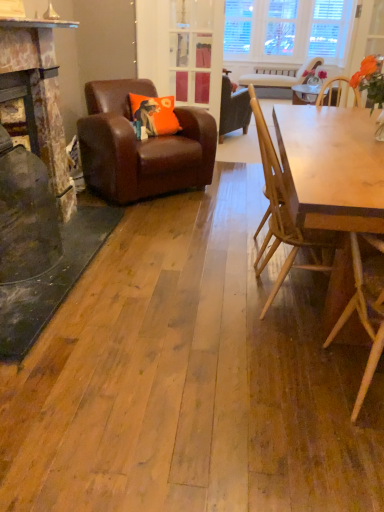
Question: Do you think light brown wooden table at right is within clear glass door at center, or outside of it?

Choices:
 (A) outside
 (B) inside

Answer: (A)

Question: Based on their positions, is light brown wooden table at right located to the left or right of clear glass door at center?

Choices:
 (A) left
 (B) right

Answer: (B)

Question: Based on their relative distances, which object is farther from the brown leather armchair at left, which is the 2th chair in back-to-front order?

Choices:
 (A) orange fabric pillow at center-left
 (B) light beige wood chair at upper center, the fourth chair ordered from the bottom
 (C) wooden chair at right, the second chair positioned from the bottom
 (D) light brown wooden table at right
 (E) clear glass door at center

Answer: (B)

Question: Which object is positioned farthest from the light beige wood chair at upper center, placed as the fourth chair when sorted from front to back?

Choices:
 (A) clear glass door at center
 (B) light brown wooden table at right
 (C) light brown wooden chair at right, acting as the second chair starting from the right
 (D) wooden chair at right, which appears as the 3th chair when viewed from the top
 (E) brown leather armchair at left, which is the first chair from left to right

Answer: (C)